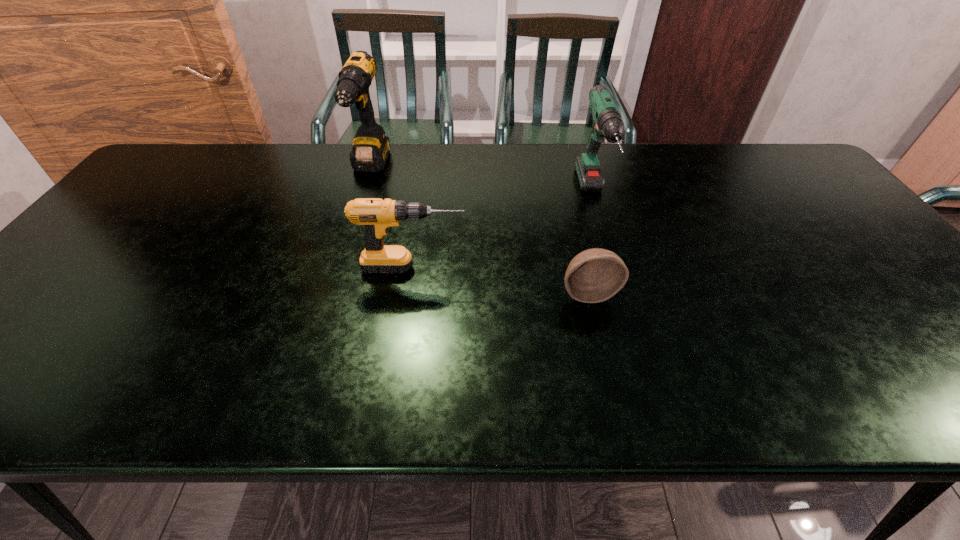
Locate an element on the screen. free point between the bowl and the third object from right to left is located at coordinates (501, 280).

Identify the location of blank region between the rightmost drill and the leftmost object. (482, 183).

Locate an element on the screen. The width and height of the screenshot is (960, 540). free area in between the second shortest object and the rightmost drill is located at coordinates (503, 232).

Identify the location of blank region between the rightmost drill and the shortest object. (590, 245).

This screenshot has width=960, height=540. I want to click on object identified as the third closest to the second drill from right to left, so click(x=607, y=124).

You are a GUI agent. You are given a task and a screenshot of the screen. Output one action in this format:
    pyautogui.click(x=<x>, y=<y>)
    Task: Click on the closest object relative to the nearest object
    The image size is (960, 540).
    Given the screenshot: What is the action you would take?
    pyautogui.click(x=607, y=124)

Locate an element on the screen. This screenshot has width=960, height=540. the closest drill to the rightmost drill is located at coordinates (378, 215).

You are a GUI agent. You are given a task and a screenshot of the screen. Output one action in this format:
    pyautogui.click(x=<x>, y=<y>)
    Task: Click on the drill identified as the closest to the leftmost object
    This screenshot has height=540, width=960.
    Given the screenshot: What is the action you would take?
    pyautogui.click(x=378, y=215)

The width and height of the screenshot is (960, 540). What are the coordinates of `vacant area that satisfies the following two spatial constraints: 1. at the tip of the bowl; 2. on the left side of the leftmost object` in the screenshot? It's located at (331, 293).

The width and height of the screenshot is (960, 540). What are the coordinates of `free space that satisfies the following two spatial constraints: 1. at the tip of the nearest object; 2. on the right side of the second shortest object` in the screenshot? It's located at (409, 293).